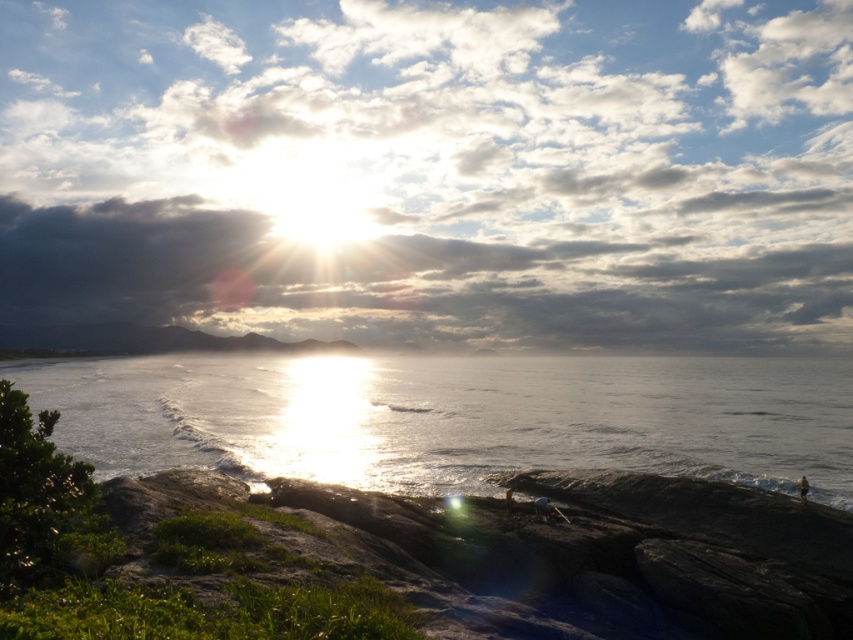
Is point (102, 310) closer to camera compared to point (825, 424)?

No, it is behind (825, 424).

Is the position of cloudy sky at upper center less distant than that of glistening silver water at center?

That is False.

The image size is (853, 640). What do you see at coordinates (433, 172) in the screenshot?
I see `cloudy sky at upper center` at bounding box center [433, 172].

Find the location of `cloudy sky at upper center`. cloudy sky at upper center is located at coordinates (433, 172).